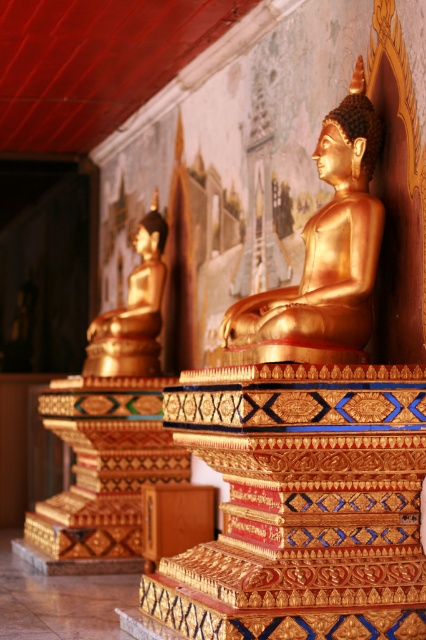
Does gold shiny statue at center have a lesser height compared to gold polished statue at left?

A: In fact, gold shiny statue at center may be taller than gold polished statue at left.

Is point (348, 136) behind point (118, 369)?

No, it is not.

This screenshot has width=426, height=640. Find the location of `gold shiny statue at center`. gold shiny statue at center is located at coordinates (324, 257).